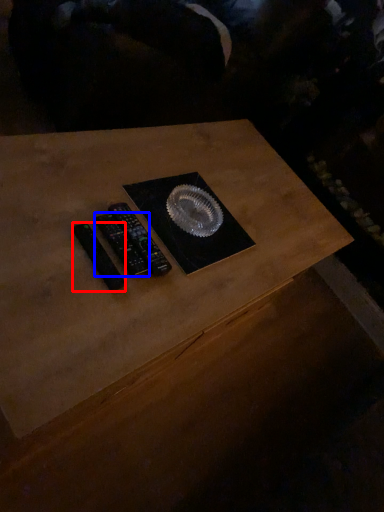
Question: Among these objects, which one is nearest to the camera, control (highlighted by a red box) or control (highlighted by a blue box)?

Choices:
 (A) control
 (B) control

Answer: (A)